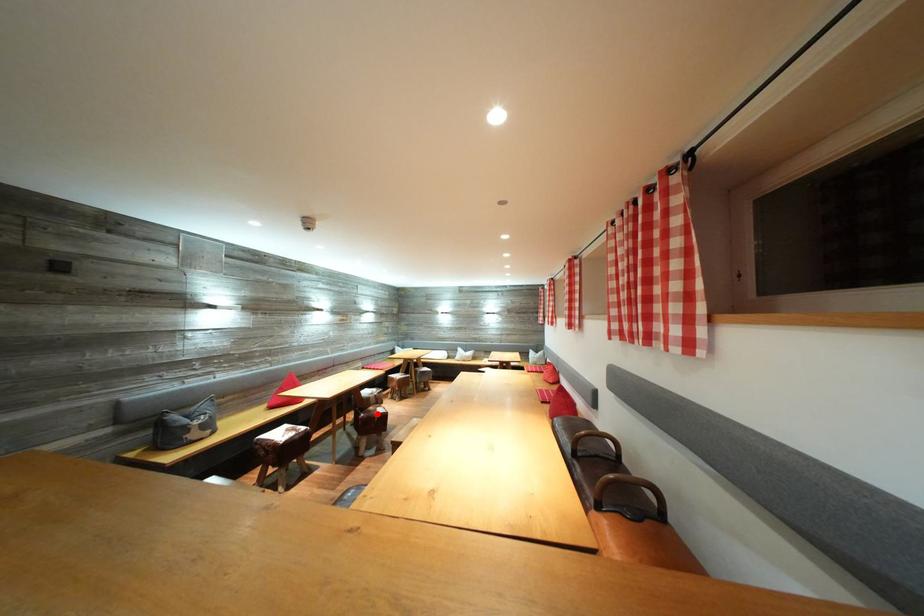
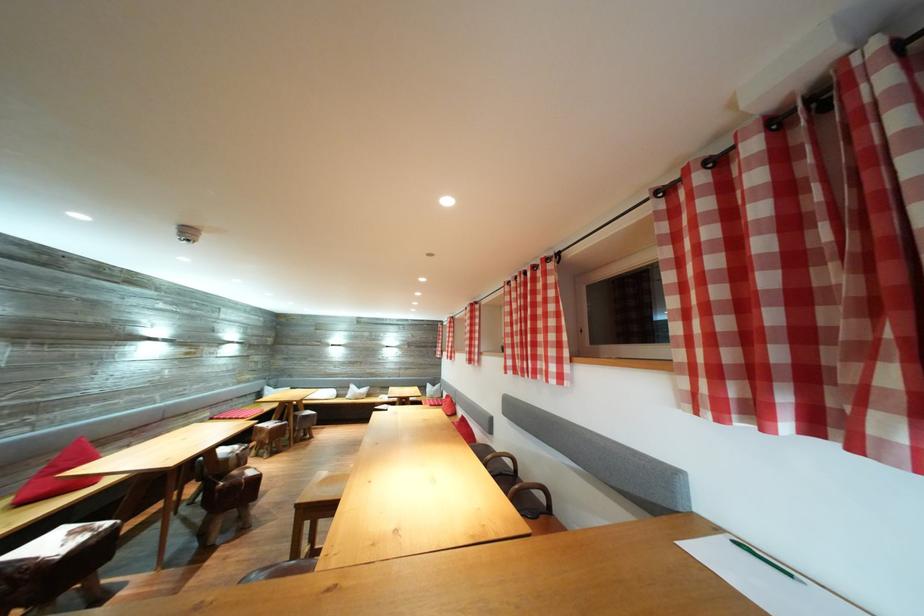
Question: I am providing you with two images of the same scene from different viewpoints. A red point is marked on the first image. Can you still see the location of the red point in image 2?

Choices:
 (A) Yes
 (B) No

Answer: (A)